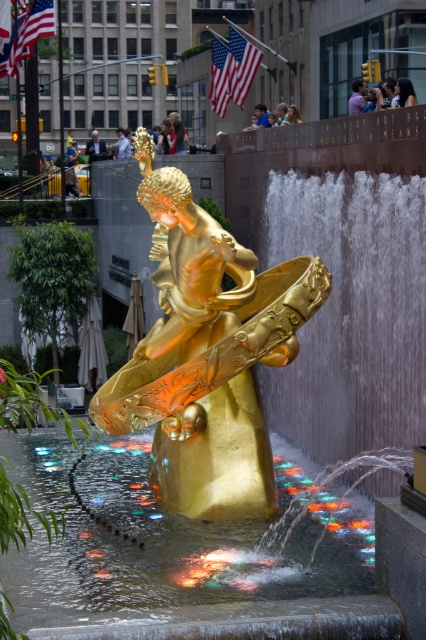
You are standing in front of the golden sculpture in the water feature. There is a translucent glass water at center represented by point [187,554]. Can you tell me the coordinates of the translucent glass water at center?

The translucent glass water at center is represented by point [187,554].

You are a maintenance worker tasked with cleaning the gold polished statue at center. You are currently standing on the edge of the translucent glass water at center. Can you reach the statue without stepping into the water? Please explain your reasoning based on the distance between them.

The distance between the translucent glass water at center and the gold polished statue at center is 9.83 feet. Since you are standing on the edge of the water, the statue is 9.83 feet away from you. Unless you have a tool or equipment that can extend your reach by at least 9.83 feet, you would not be able to reach the statue without stepping into the water.